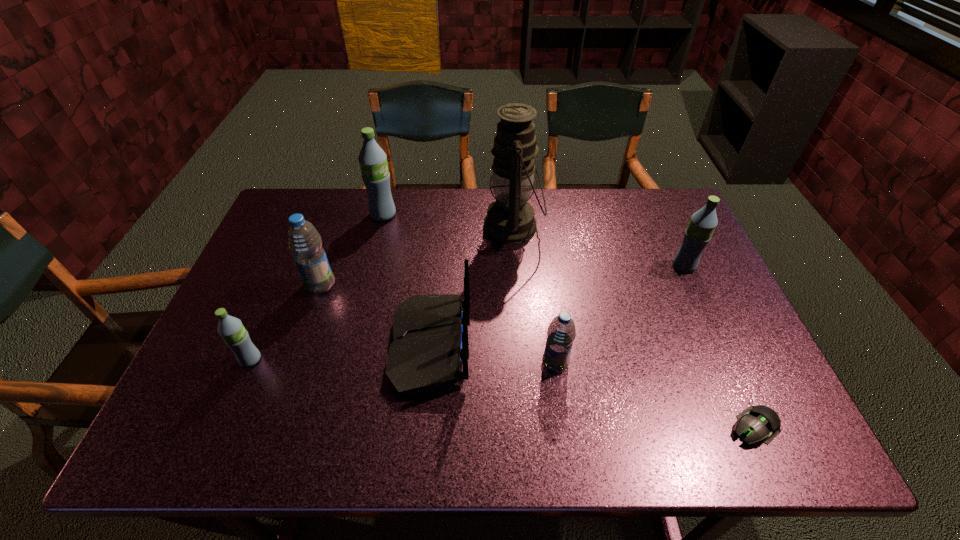
In the image, there is a desktop. At what (x,y) coordinates should I click in order to perform the action: click on vacant space at the far edge. Please return your answer as a coordinate pair (x, y). Looking at the image, I should click on (553, 204).

Locate an element on the screen. The height and width of the screenshot is (540, 960). blank space at the near edge of the desktop is located at coordinates (630, 432).

The width and height of the screenshot is (960, 540). Identify the location of free space at the left edge. (274, 303).

Locate an element on the screen. The width and height of the screenshot is (960, 540). free space at the right edge of the desktop is located at coordinates (730, 312).

The height and width of the screenshot is (540, 960). Identify the location of vacant space at the near left corner. click(x=221, y=453).

This screenshot has width=960, height=540. In order to click on free space between the smaller blue water bottle and the second nearest green water bottle in this screenshot , I will do `click(619, 315)`.

Find the location of a particular element. free space between the smaller blue water bottle and the tallest object is located at coordinates (534, 295).

Locate an element on the screen. Image resolution: width=960 pixels, height=540 pixels. free space between the left blue water bottle and the nearest green water bottle is located at coordinates click(285, 322).

Where is `free space that is in between the shortest object and the router`? The height and width of the screenshot is (540, 960). free space that is in between the shortest object and the router is located at coordinates (592, 386).

Where is `unoccupied position between the farthest green water bottle and the nearer blue water bottle`? This screenshot has width=960, height=540. unoccupied position between the farthest green water bottle and the nearer blue water bottle is located at coordinates (469, 289).